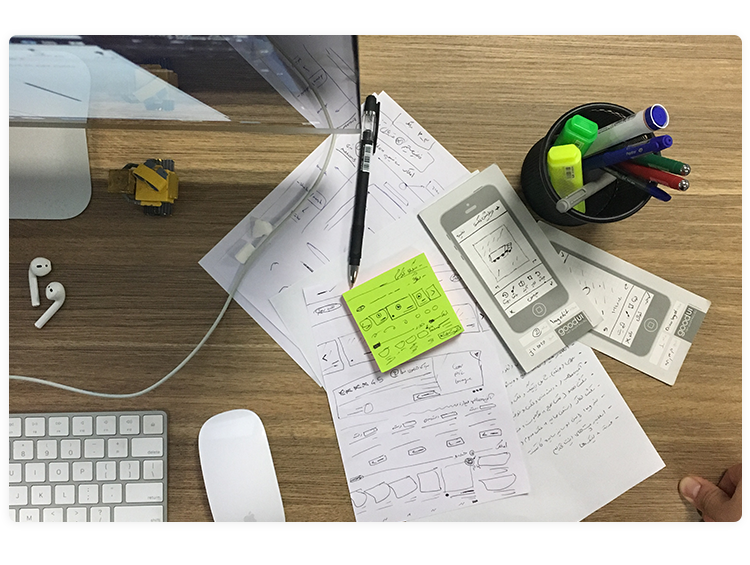
Where is `monitor`? Image resolution: width=750 pixels, height=565 pixels. monitor is located at coordinates (217, 73).